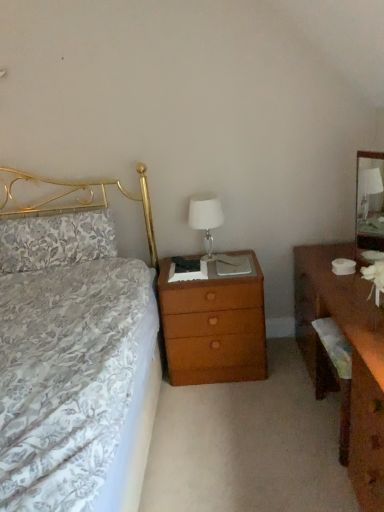
This screenshot has height=512, width=384. In order to click on vacant space situated above brown wood nightstand at center (from a real-world perspective) in this screenshot , I will do `click(200, 266)`.